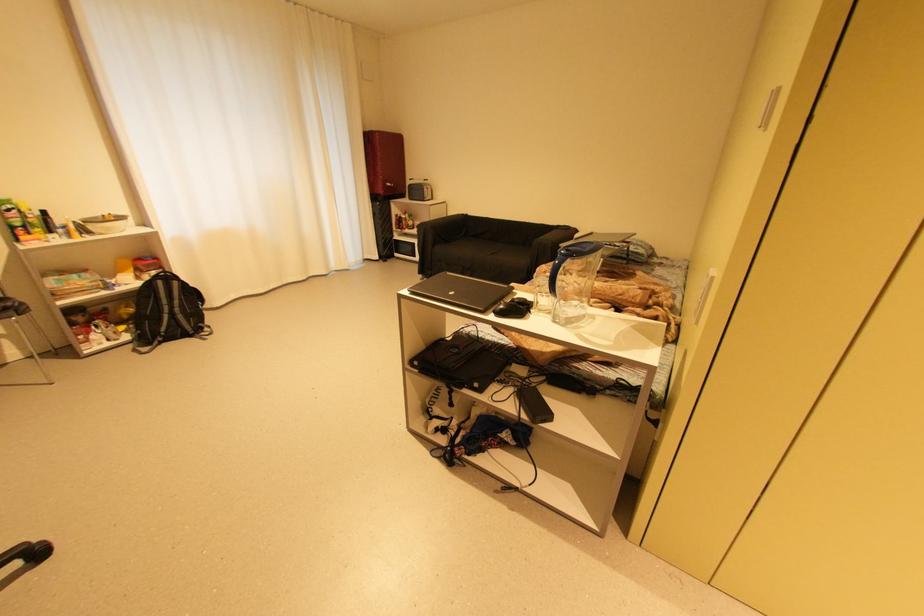
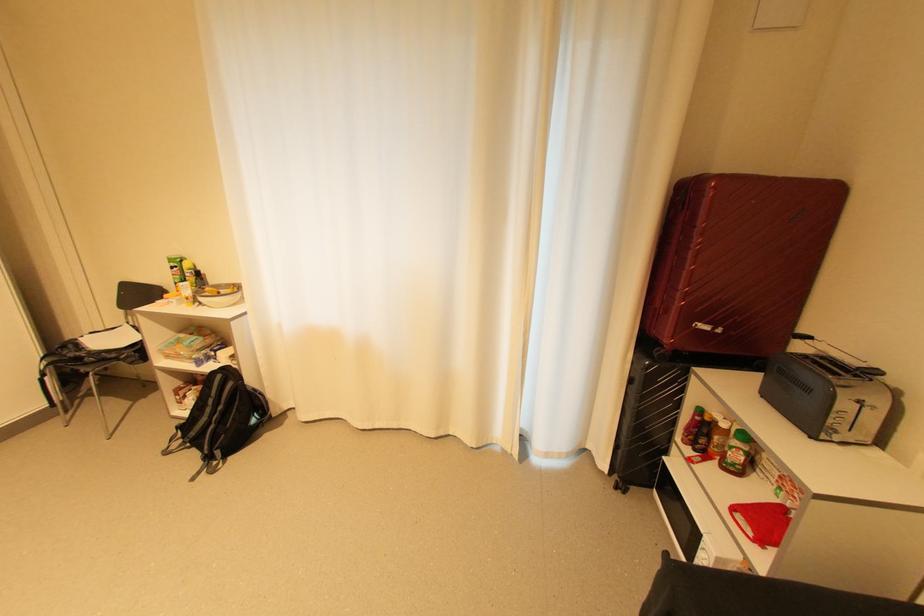
In the second image, find the point that corresponds to (382,215) in the first image.

(638, 381)